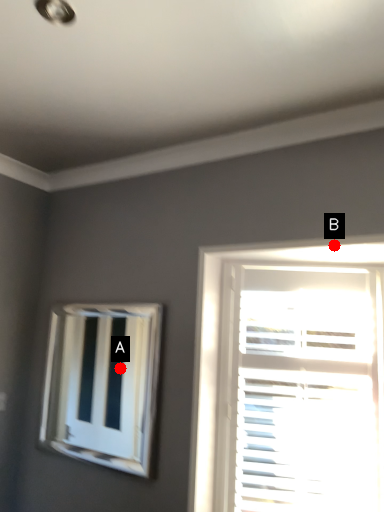
Question: Two points are circled on the image, labeled by A and B beside each circle. Which point appears farthest from the camera in this image?

Choices:
 (A) A is further
 (B) B is further

Answer: (A)